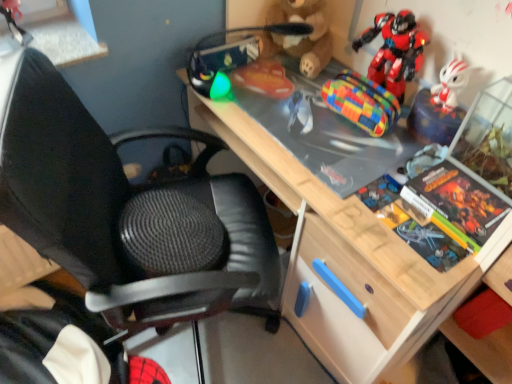
Locate an element on the screen. Image resolution: width=512 pixels, height=384 pixels. free space in front of shiny plastic robot at upper right, which appears as the 1th toy when viewed from the right is located at coordinates (368, 144).